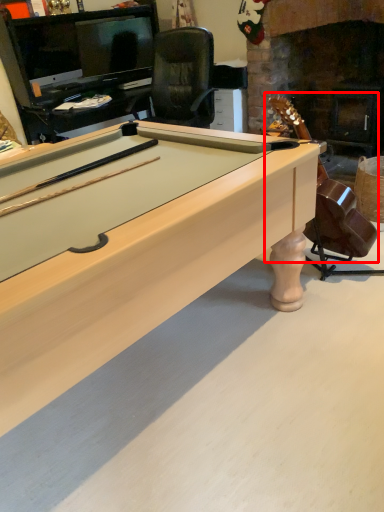
Question: Considering the relative positions of guitar (annotated by the red box) and billiard table in the image provided, where is guitar (annotated by the red box) located with respect to the staircase?

Choices:
 (A) left
 (B) right

Answer: (B)